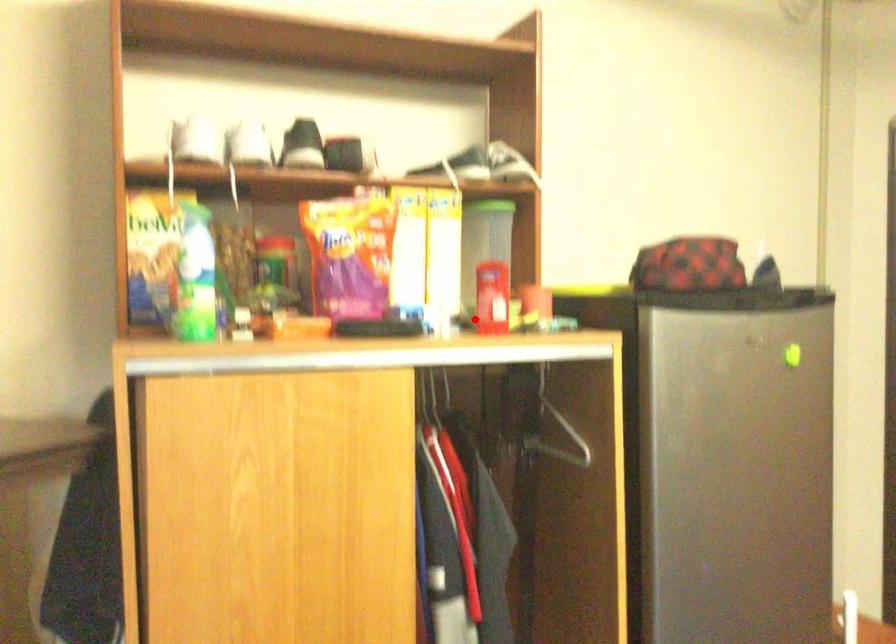
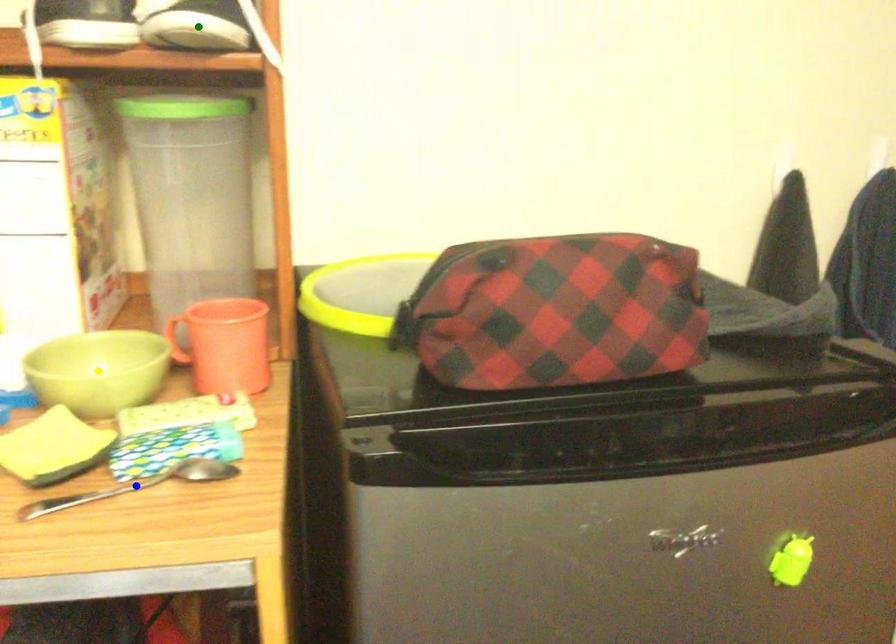
Question: I am providing you with two images of the same scene from different viewpoints. A red point is marked on the first image. You are given multiple points on the second image. Which mark in image 2 goes with the point in image 1?

Choices:
 (A) green point
 (B) yellow point
 (C) blue point

Answer: (B)